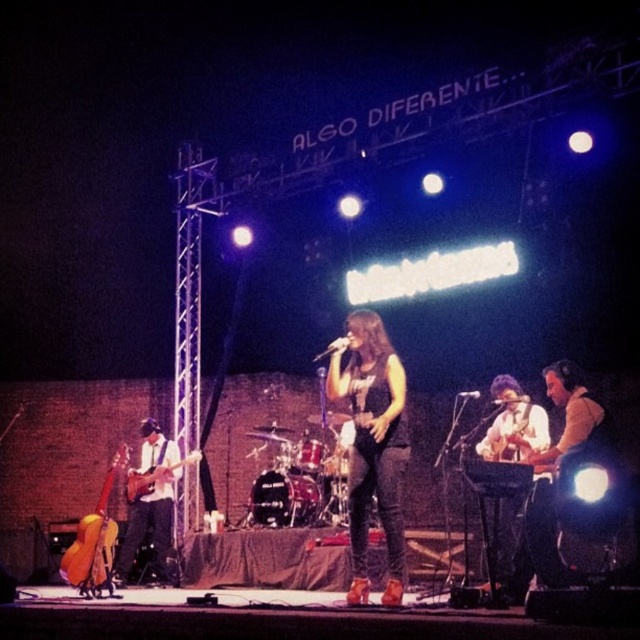
You are a stagehand needing to move a 20 cm wide equipment cart between the matte black guitar at left and the matte electric guitar at left. Can the cart fit through the space between them?

The distance between the matte black guitar at left and the matte electric guitar at left is 20.54 centimeters. Since the cart is 20 cm wide, it can fit through the space as there is enough clearance.

You are a stagehand who needs to adjust the lighting for the guitarist playing the matte black guitar at left and the matte electric guitar at left. Which guitar should you focus on first if you need to adjust the lighting closer to the front of the stage?

The matte black guitar at left is in front of the matte electric guitar at left, so you should focus on adjusting the lighting for the matte black guitar at left first since it is closer to the front.

You are a stagehand who needs to place a new spotlight at the coordinates point (150,500). Which object will be illuminated by this spotlight?

The point (150,500) corresponds to the matte black guitar at left, so the spotlight will illuminate the matte black guitar at left.